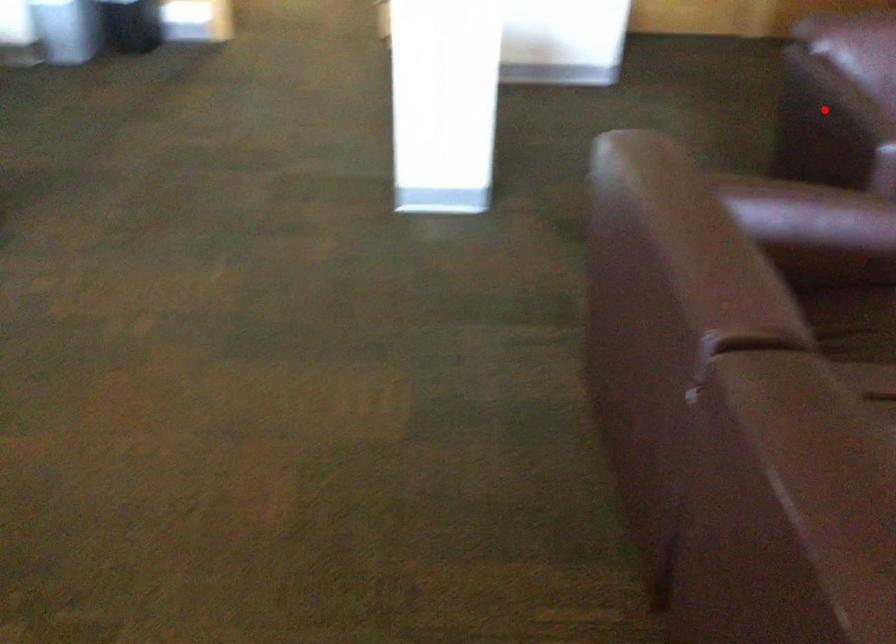
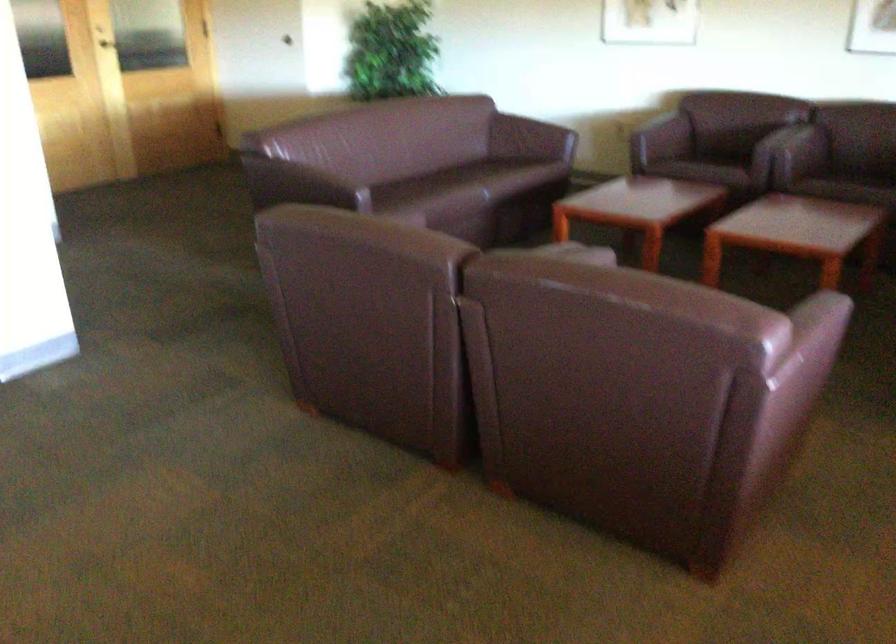
Question: I am providing you with two images of the same scene from different viewpoints. In image1, a red point is highlighted. Considering the same 3D point in image2, which of the following is correct?

Choices:
 (A) It is closer
 (B) It is farther

Answer: (B)